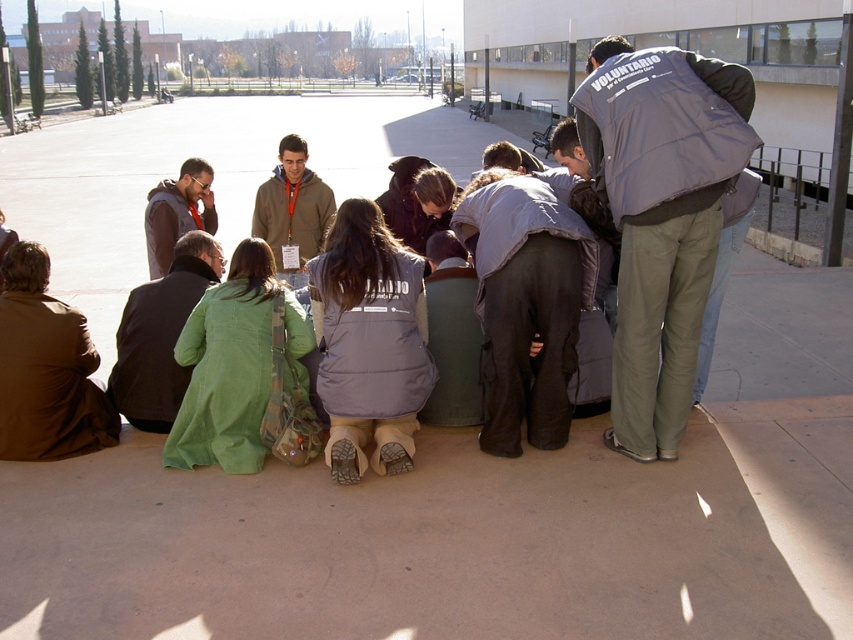
In the scene shown: You are a photographer trying to capture a group photo of the people at the event. You notice the gray fabric jacket at center and the matte brown jacket at lower left. Which jacket should you focus on first to ensure both are in the frame?

The gray fabric jacket at center is below the matte brown jacket at lower left, so you should focus on the matte brown jacket at lower left first to ensure both are in the frame.

Consider the image. You are a photographer trying to capture a photo of the group without any clothing labels visible. The gray puffy vest at center has a label on its back and the green fabric jacket at lower left has a label on its front. Based on their positions and the description, which clothing item is more likely to have its label visible in the photo?

The gray puffy vest at center has a greater height compared to the green fabric jacket at lower left, so the label on the back of the gray puffy vest at center is more likely to be visible in the photo since it is taller and might be positioned in a way that its back is facing the camera.

You are standing at the origin point of the coordinate system where the image is mapped. The gray fabric jacket at center is at coordinates 0.475, 0.617. If you want to walk directly to the jacket, in which direction should you move?

You should move in the direction of the coordinates (525, 304) to reach the gray fabric jacket at center.